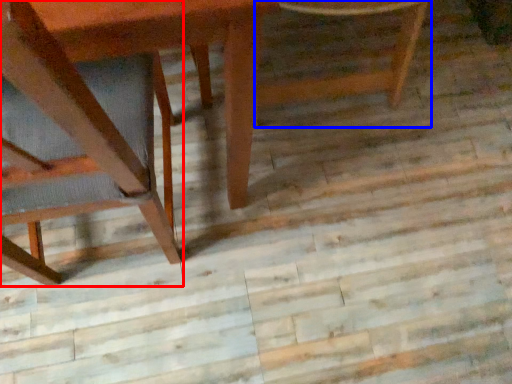
Question: Which point is closer to the camera, chair (highlighted by a red box) or chair (highlighted by a blue box)?

Choices:
 (A) chair
 (B) chair

Answer: (A)